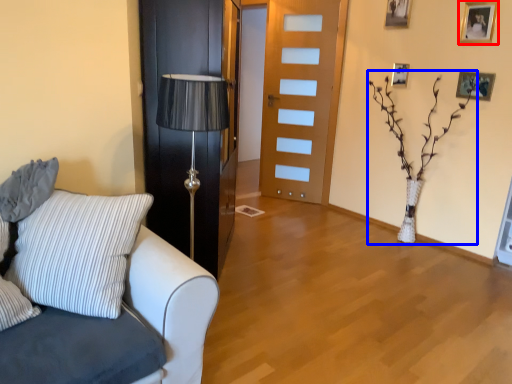
Question: Which of the following is the farthest to the observer, picture frame (highlighted by a red box) or plant (highlighted by a blue box)?

Choices:
 (A) picture frame
 (B) plant

Answer: (A)